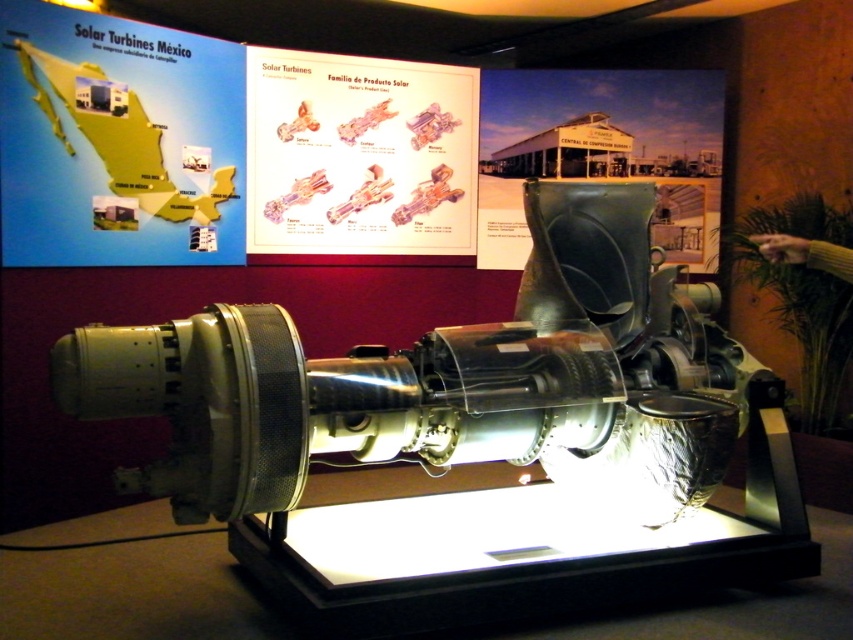
You are standing in front of the exhibition display and want to take a photo. You notice two points marked on the image. The first point is at coordinate point (x=207, y=252) and the second is at point (x=695, y=132). Which point will appear larger in your photo?

Point (x=207, y=252) is closer to the camera than point (x=695, y=132), so it will appear larger in the photo.

You are an event planner setting up a booth for a tech conference. You need to place a new poster that is 1.2 meters tall. The blue map at upper left and the green matte sign at upper center are already mounted. Which object can you place the poster next to without blocking it if the poster must be taller than both existing objects?

The blue map at upper left is shorter than the green matte sign at upper center. Since the poster is 1.2 meters tall, it can be placed next to both existing objects without being blocked, as it is taller than both.